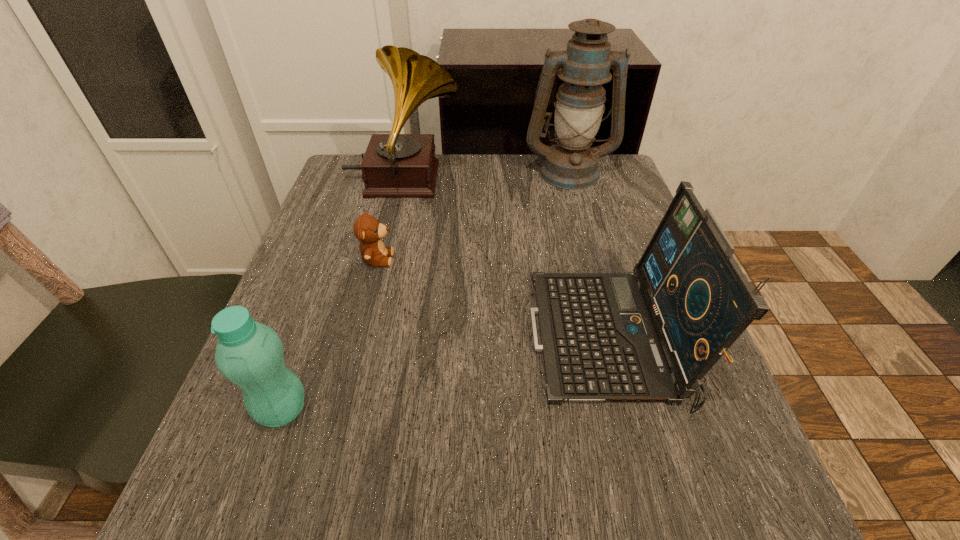
You are a GUI agent. You are given a task and a screenshot of the screen. Output one action in this format:
    pyautogui.click(x=<x>, y=<y>)
    Task: Click on the vacant position in the image that satisfies the following two spatial constraints: 1. on the front-facing side of the laptop computer; 2. on the front side of the bottle
    Image resolution: width=960 pixels, height=540 pixels.
    Given the screenshot: What is the action you would take?
    pyautogui.click(x=627, y=410)